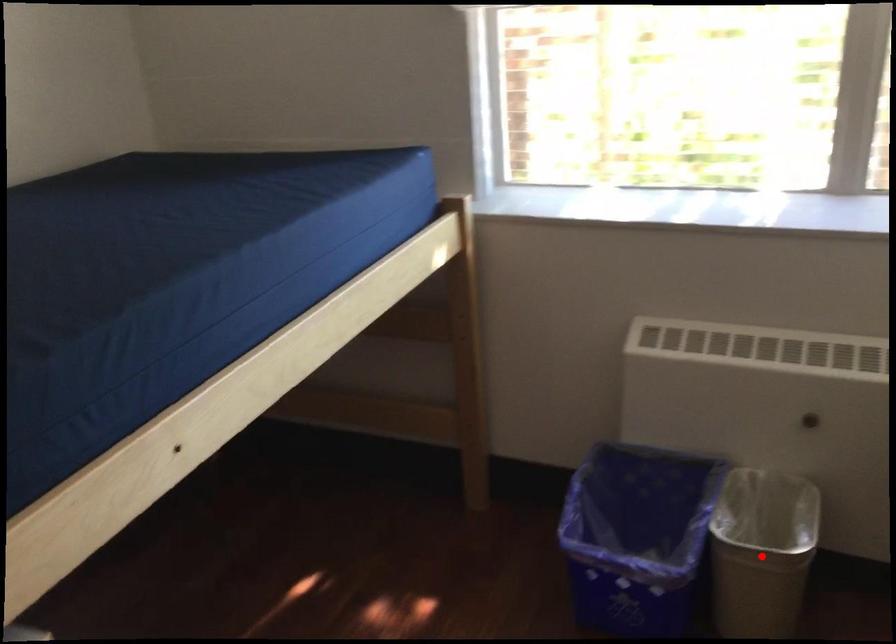
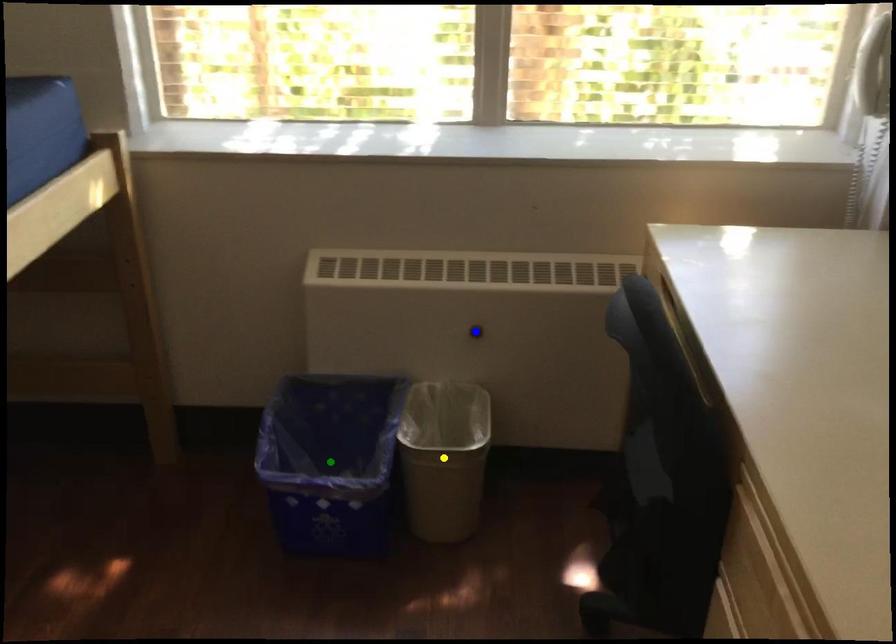
Question: I am providing you with two images of the same scene from different viewpoints. A red point is marked on the first image. You are given multiple points on the second image. Can you choose the point in image 2 that corresponds to the point in image 1?

Choices:
 (A) yellow point
 (B) blue point
 (C) green point

Answer: (A)